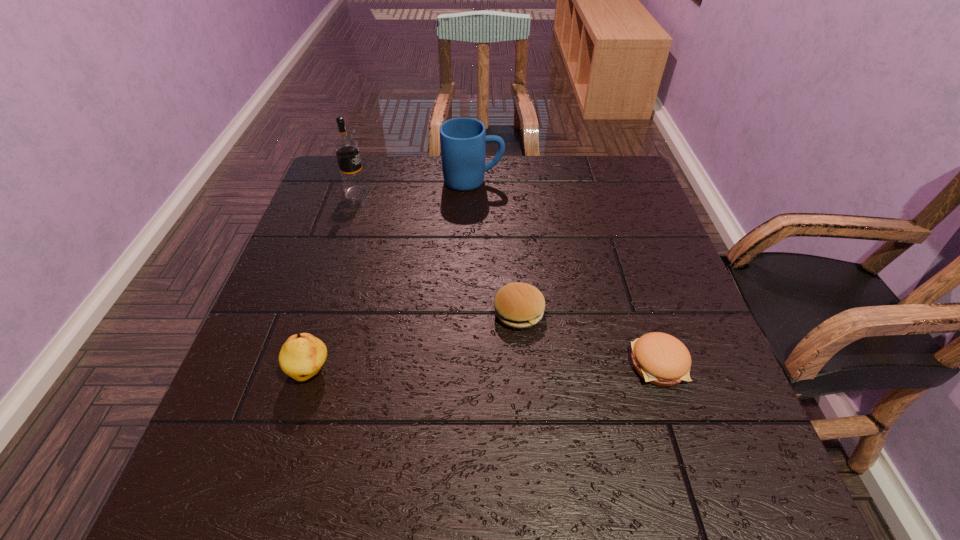
Find the location of a particular element. The height and width of the screenshot is (540, 960). free space at the left edge is located at coordinates (297, 299).

The width and height of the screenshot is (960, 540). What are the coordinates of `vacant space at the right edge of the desktop` in the screenshot? It's located at (708, 362).

Find the location of a particular element. vacant space at the far left corner of the desktop is located at coordinates (372, 157).

You are a GUI agent. You are given a task and a screenshot of the screen. Output one action in this format:
    pyautogui.click(x=<x>, y=<y>)
    Task: Click on the blank space at the near left corner
    This screenshot has width=960, height=540.
    Given the screenshot: What is the action you would take?
    pyautogui.click(x=206, y=501)

This screenshot has width=960, height=540. In the image, there is a desktop. Find the location of `free space at the far right corner`. free space at the far right corner is located at coordinates (643, 193).

You are a GUI agent. You are given a task and a screenshot of the screen. Output one action in this format:
    pyautogui.click(x=<x>, y=<y>)
    Task: Click on the blank region between the third shortest object and the vodka
    The width and height of the screenshot is (960, 540).
    Given the screenshot: What is the action you would take?
    pyautogui.click(x=334, y=282)

At what (x,y) coordinates should I click in order to perform the action: click on vacant area between the mug and the left patty. Please return your answer as a coordinate pair (x, y). The width and height of the screenshot is (960, 540). Looking at the image, I should click on (496, 246).

Locate an element on the screen. This screenshot has width=960, height=540. vacant space that's between the pear and the fourth shortest object is located at coordinates (392, 276).

At what (x,y) coordinates should I click in order to perform the action: click on vacant point located between the mug and the vodka. Please return your answer as a coordinate pair (x, y). Looking at the image, I should click on (415, 187).

In order to click on unoccupied position between the right patty and the vodka in this screenshot , I will do `click(508, 278)`.